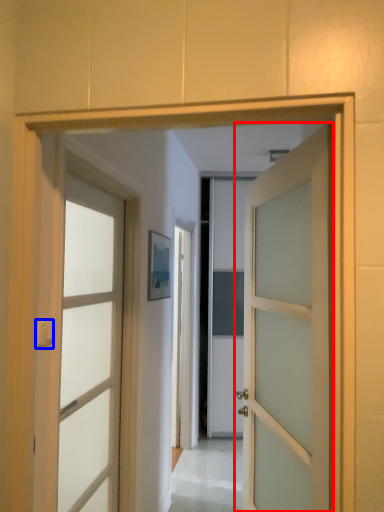
Question: Which object is closer to the camera taking this photo, door (highlighted by a red box) or door handle (highlighted by a blue box)?

Choices:
 (A) door
 (B) door handle

Answer: (A)